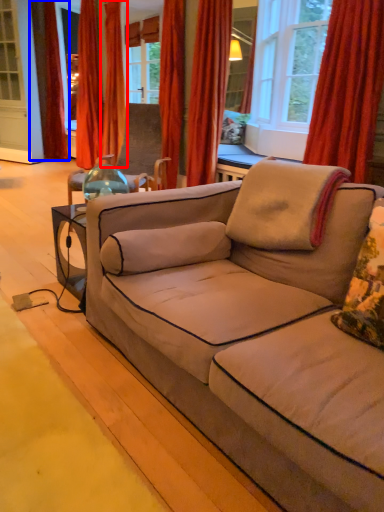
Question: Which object is further to the camera taking this photo, curtain (highlighted by a red box) or curtain (highlighted by a blue box)?

Choices:
 (A) curtain
 (B) curtain

Answer: (B)